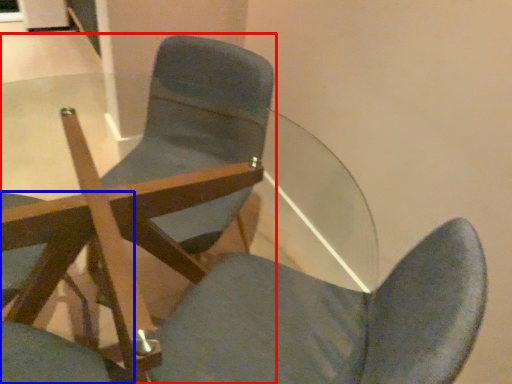
Question: Which object is closer to the camera taking this photo, chair (highlighted by a red box) or chair (highlighted by a blue box)?

Choices:
 (A) chair
 (B) chair

Answer: (B)